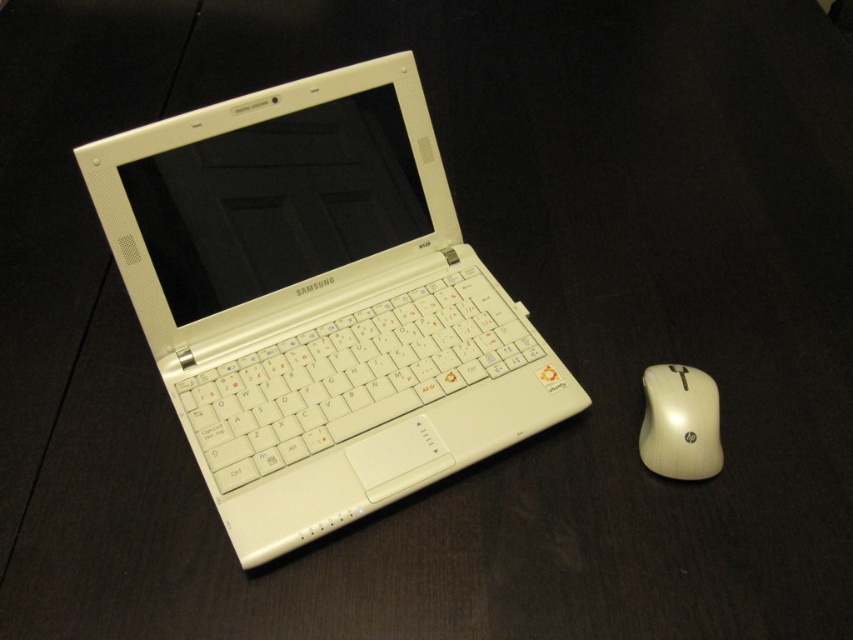
You need to place a new wireless charger that is 10 cm wide between the white matte keyboard at center and the white plastic mouse at right. Can you fit it there?

The white matte keyboard at center is to the left of white plastic mouse at right, so there is space between them. The charger is 10 cm wide and can fit between them if the distance between the keyboard and mouse is at least 10 cm. However, the exact distance isn not provided, so it depends on the actual spacing available.

You are setting up a workspace and want to place both the white plastic laptop at center and the white matte keyboard at center side by side on a desk. Based on their sizes, which one should be placed first to ensure they fit properly?

The white plastic laptop at center is wider than the white matte keyboard at center. Therefore, you should place the white plastic laptop at center first to accommodate its larger width, then position the white matte keyboard at center next to it.